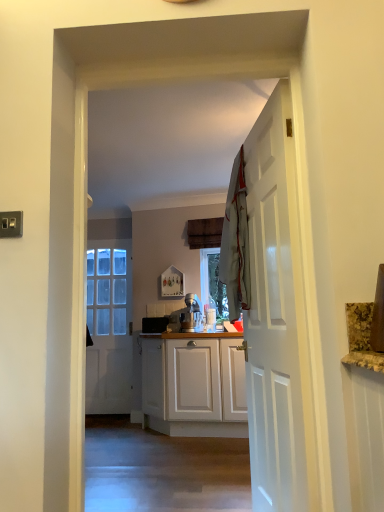
Question: Is white wooden door at right, the 2th door positioned from the back, surrounded by light gray fabric at center?

Choices:
 (A) no
 (B) yes

Answer: (A)

Question: Considering the relative sizes of light gray fabric at center and white wooden door at right, the second door when ordered from left to right, in the image provided, is light gray fabric at center smaller than white wooden door at right, the second door when ordered from left to right,?

Choices:
 (A) no
 (B) yes

Answer: (B)

Question: Is light gray fabric at center turned away from white wooden door at right, acting as the first door starting from the right?

Choices:
 (A) yes
 (B) no

Answer: (A)

Question: Are light gray fabric at center and white wooden door at right, positioned as the first door in front-to-back order, located far from each other?

Choices:
 (A) no
 (B) yes

Answer: (A)

Question: Does light gray fabric at center have a larger size compared to white wooden door at right, the second door when ordered from left to right?

Choices:
 (A) no
 (B) yes

Answer: (A)

Question: From a real-world perspective, is light gray fabric at center located higher than white wooden door at right, positioned as the first door in front-to-back order?

Choices:
 (A) yes
 (B) no

Answer: (A)

Question: Can you confirm if white wooden door at right, positioned as the first door in front-to-back order, is thinner than white glossy door at center, arranged as the 2th door when viewed from the front?

Choices:
 (A) no
 (B) yes

Answer: (A)

Question: Is white wooden door at right, positioned as the first door in front-to-back order, turned away from white glossy door at center, the first door when ordered from left to right?

Choices:
 (A) no
 (B) yes

Answer: (A)

Question: Is white wooden door at right, the 2th door positioned from the back, shorter than white glossy door at center, arranged as the 2th door when viewed from the front?

Choices:
 (A) yes
 (B) no

Answer: (A)

Question: Can we say white wooden door at right, the second door when ordered from left to right, lies outside white glossy door at center, arranged as the 2th door when viewed from the front?

Choices:
 (A) yes
 (B) no

Answer: (A)

Question: Considering the relative sizes of white wooden door at right, the second door when ordered from left to right, and white glossy door at center, the second door positioned from the right, in the image provided, is white wooden door at right, the second door when ordered from left to right, smaller than white glossy door at center, the second door positioned from the right,?

Choices:
 (A) yes
 (B) no

Answer: (B)

Question: Does light gray fabric at center come behind white glossy door at center, the first door when ordered from back to front?

Choices:
 (A) yes
 (B) no

Answer: (B)